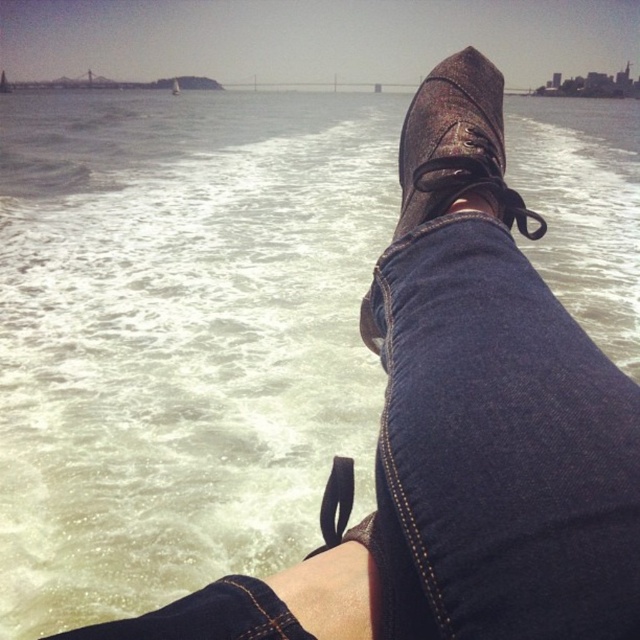
Question: Does leather boot at center have a lesser width compared to white plastic sailboat at upper center?

Choices:
 (A) no
 (B) yes

Answer: (B)

Question: Which of the following is the farthest from the observer?

Choices:
 (A) leather boot at center
 (B) white plastic sailboat at upper center

Answer: (B)

Question: Does leather boot at center have a smaller size compared to white plastic sailboat at upper center?

Choices:
 (A) no
 (B) yes

Answer: (B)

Question: Is leather boot at center to the left of white plastic sailboat at upper center from the viewer's perspective?

Choices:
 (A) no
 (B) yes

Answer: (A)